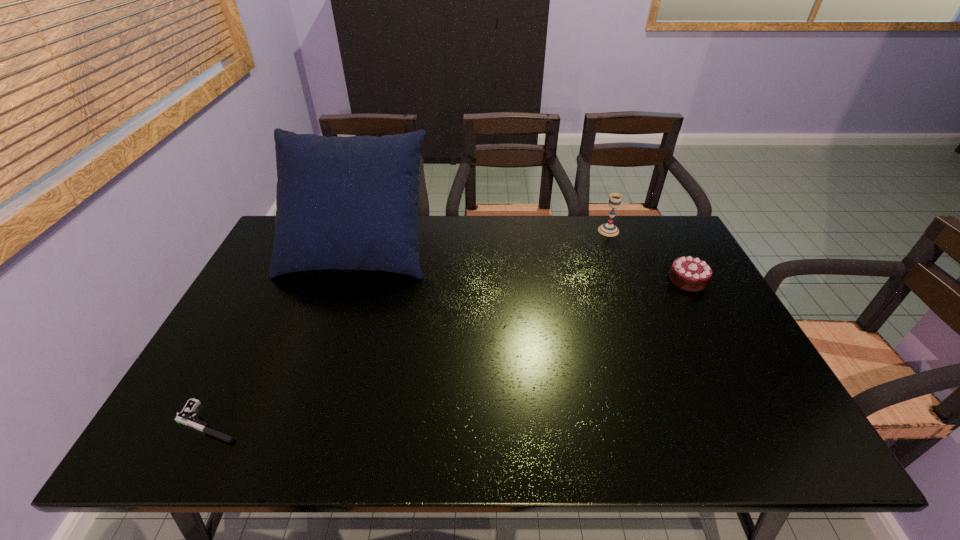
The image size is (960, 540). What are the coordinates of `free space that satisfies the following two spatial constraints: 1. on the front side of the third tallest object; 2. on the front-facing side of the shortest object` in the screenshot? It's located at (763, 422).

Where is `vacant position in the image that satisfies the following two spatial constraints: 1. on the facing side of the tallest object; 2. on the front-facing side of the nearest object`? vacant position in the image that satisfies the following two spatial constraints: 1. on the facing side of the tallest object; 2. on the front-facing side of the nearest object is located at coordinates (298, 422).